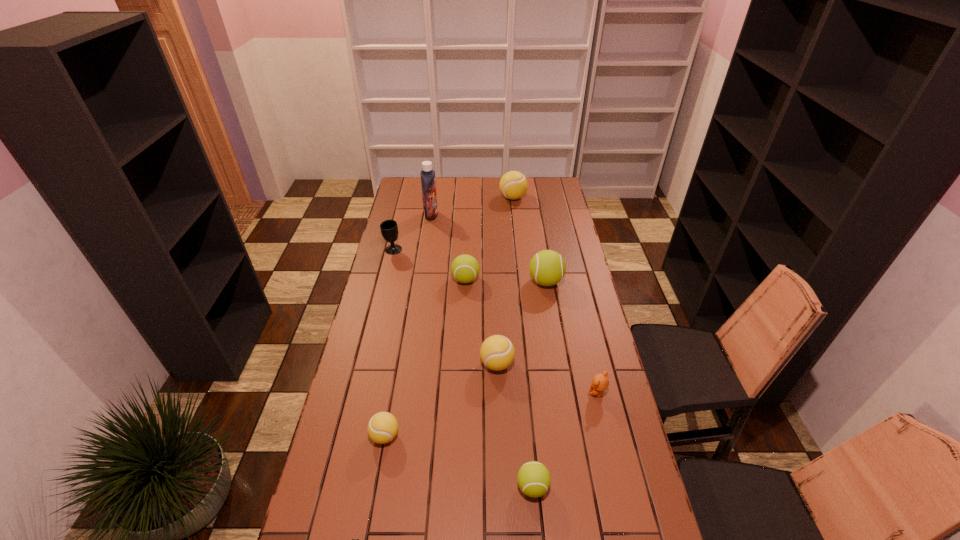
In order to click on free space located on the back of the sixth farthest object in this screenshot , I will do `click(495, 322)`.

Image resolution: width=960 pixels, height=540 pixels. Find the location of `free space located on the left of the fifth object from left to right`. free space located on the left of the fifth object from left to right is located at coordinates (440, 280).

Locate an element on the screen. blank space located on the face of the rightmost object is located at coordinates (480, 393).

The image size is (960, 540). Identify the location of vacant space located 0.290m on the face of the rightmost object. (501, 393).

Where is `vacant space located 0.330m on the face of the rightmost object`? Image resolution: width=960 pixels, height=540 pixels. vacant space located 0.330m on the face of the rightmost object is located at coordinates (489, 393).

Locate an element on the screen. vacant region located 0.150m on the back of the nearest yellow tennis ball is located at coordinates (395, 382).

Locate an element on the screen. Image resolution: width=960 pixels, height=540 pixels. vacant space located on the back of the nearest tennis ball is located at coordinates (522, 371).

At what (x,y) coordinates should I click in order to perform the action: click on object that is at the far edge. Please return your answer as a coordinate pair (x, y). The image size is (960, 540). Looking at the image, I should click on (513, 185).

Find the location of `chalice present at the left edge`. chalice present at the left edge is located at coordinates (389, 229).

This screenshot has width=960, height=540. In order to click on tennis ball that is at the left edge in this screenshot , I will do `click(382, 428)`.